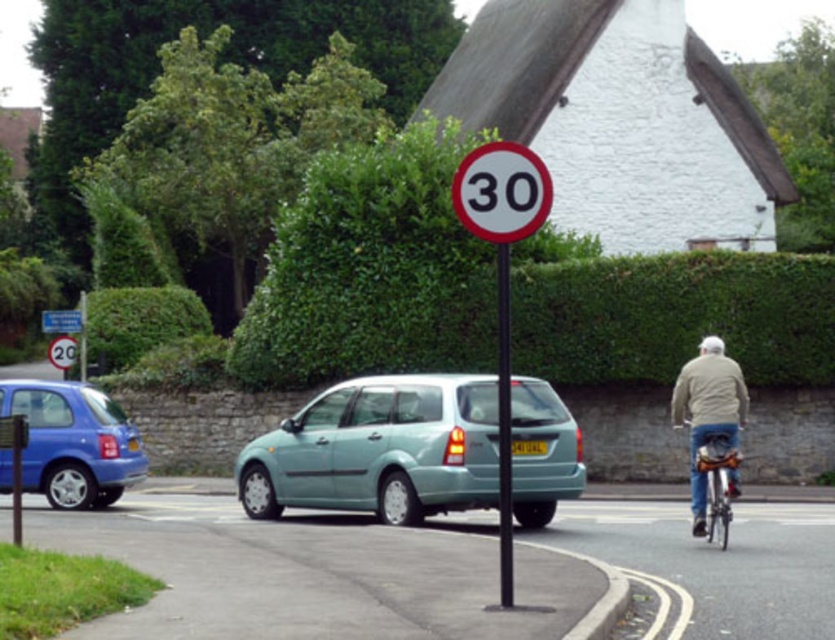
Question: Is light blue matte hatchback at center further to camera compared to yellow metallic license plate at center?

Choices:
 (A) yes
 (B) no

Answer: (B)

Question: Among these objects, which one is farthest from the camera?

Choices:
 (A) yellow metallic license plate at center
 (B) metallic blue hatchback at left
 (C) metallic silver bicycle at right
 (D) blue plastic sign at upper left

Answer: (D)

Question: Which of these objects is positioned closest to the light blue matte hatchback at center?

Choices:
 (A) metallic silver bicycle at right
 (B) blue plastic sign at upper left
 (C) light beige jacket at right

Answer: (A)

Question: Is light blue matte hatchback at center below yellow metallic license plate at center?

Choices:
 (A) yes
 (B) no

Answer: (A)

Question: Which object is the closest to the blue plastic sign at upper left?

Choices:
 (A) metallic blue hatchback at left
 (B) light blue matte hatchback at center
 (C) metallic silver bicycle at right
 (D) black metal pole at center

Answer: (A)

Question: Is white plastic speed limit sign at center to the right of metallic silver bicycle at right from the viewer's perspective?

Choices:
 (A) yes
 (B) no

Answer: (B)